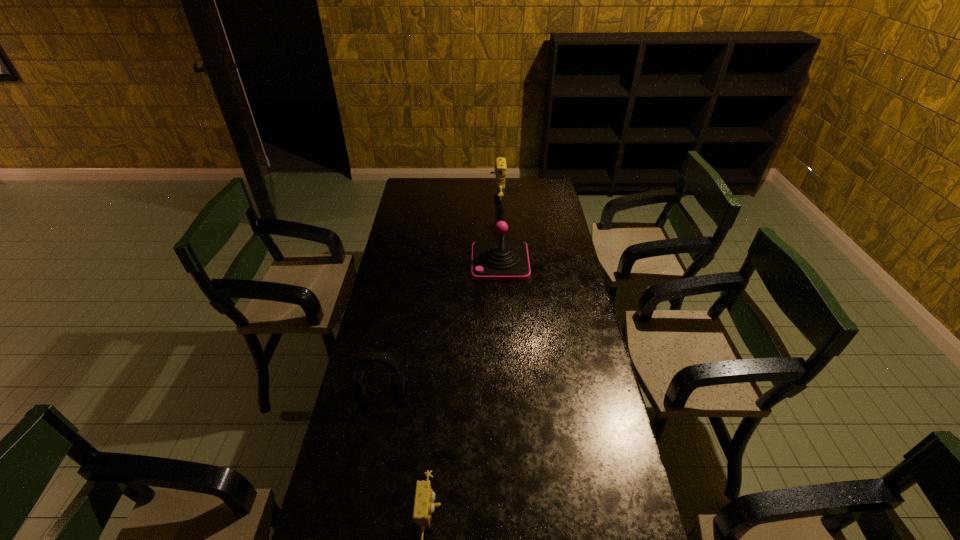
Identify the location of the farther sponge. (500, 168).

Find the location of a particular element. This screenshot has width=960, height=540. the farthest object is located at coordinates (500, 168).

Find the location of `the third nearest object`. the third nearest object is located at coordinates (500, 260).

Identify the location of the third farthest object. (358, 383).

Identify the location of headset. This screenshot has height=540, width=960. (358, 383).

Locate an element on the screen. vacant space located 0.340m on the face of the farther sponge is located at coordinates (426, 200).

Identify the location of vacant position located on the face of the farther sponge. This screenshot has width=960, height=540. (424, 200).

This screenshot has width=960, height=540. Identify the location of vacant space situated on the face of the farther sponge. (439, 200).

Where is `free space located forward from the base of the second farthest object`? The width and height of the screenshot is (960, 540). free space located forward from the base of the second farthest object is located at coordinates (425, 262).

You are a GUI agent. You are given a task and a screenshot of the screen. Output one action in this format:
    pyautogui.click(x=<x>, y=<y>)
    Task: Click on the vacant space located forward from the base of the second farthest object
    This screenshot has width=960, height=540.
    Given the screenshot: What is the action you would take?
    pyautogui.click(x=456, y=262)